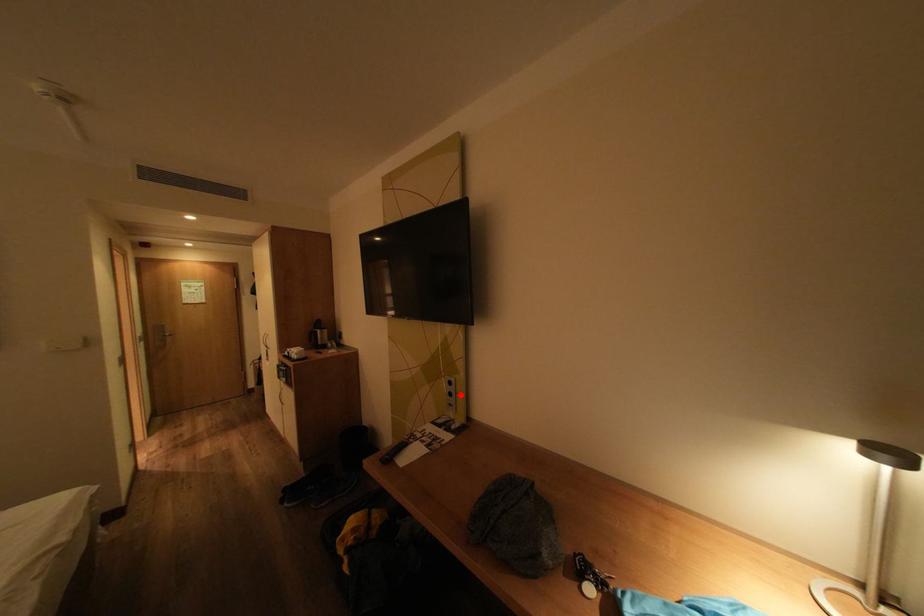
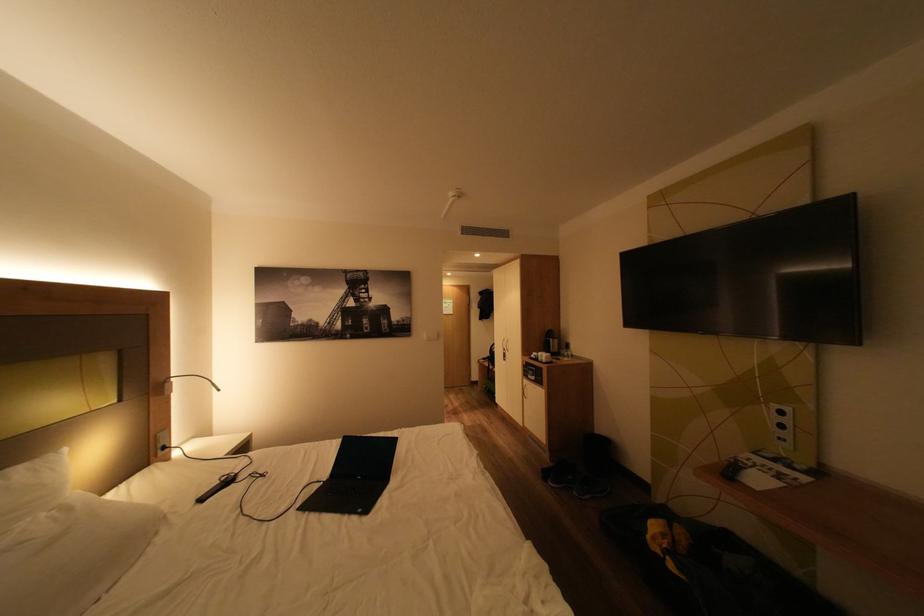
Question: I am providing you with two images of the same scene from different viewpoints. In image1, a red point is highlighted. Considering the same 3D point in image2, which of the following is correct?

Choices:
 (A) It is closer
 (B) It is farther

Answer: (A)